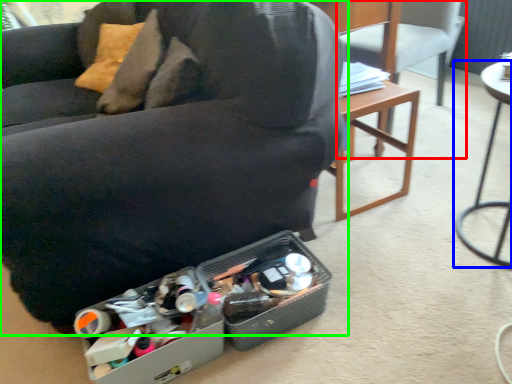
Question: Estimate the real-world distances between objects in this image. Which object is farther from chair (highlighted by a red box), table (highlighted by a blue box) or chair (highlighted by a green box)?

Choices:
 (A) table
 (B) chair

Answer: (B)